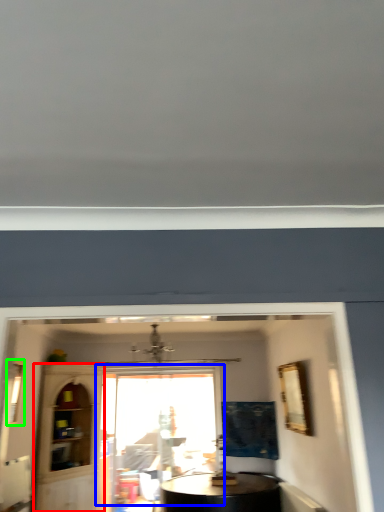
Question: Based on their relative distances, which object is farther from glass door (highlighted by a red box)? Choose from window (highlighted by a blue box) and window (highlighted by a green box).

Choices:
 (A) window
 (B) window

Answer: (B)